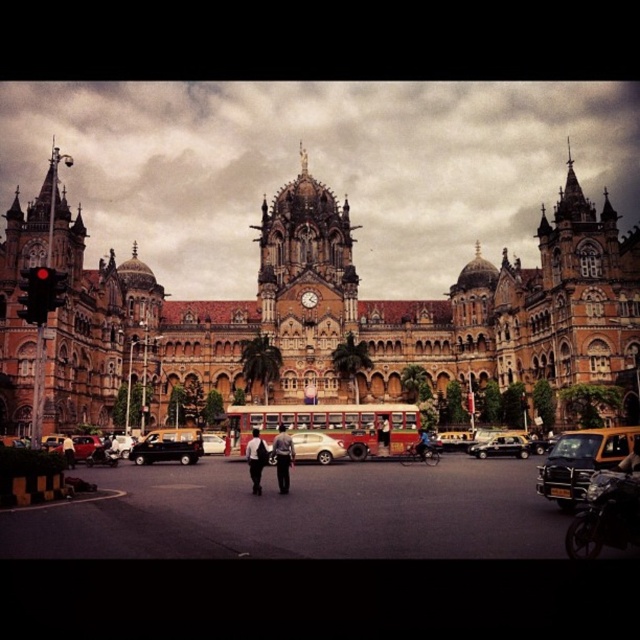
Is gold metallic sedan at center smaller than dark blue jeans at center?

No.

Between gold metallic sedan at center and dark blue jeans at center, which one has less height?

dark blue jeans at center

The height and width of the screenshot is (640, 640). In order to click on gold metallic sedan at center in this screenshot , I will do `click(316, 445)`.

Who is positioned more to the left, red matte bus at center or black glossy car at center?

From the viewer's perspective, red matte bus at center appears more on the left side.

Is red matte bus at center to the right of black glossy car at center from the viewer's perspective?

No, red matte bus at center is not to the right of black glossy car at center.

Who is more forward, (326, 417) or (474, 454)?

Point (326, 417) is in front.

Where is `red matte bus at center`? Image resolution: width=640 pixels, height=640 pixels. red matte bus at center is located at coordinates (328, 426).

Which is more to the left, dark gray pants at center or black leather jacket at center?

dark gray pants at center

Based on the photo, who is taller, dark gray pants at center or black leather jacket at center?

dark gray pants at center is taller.

Who is more forward, (289, 483) or (385, 442)?

Positioned in front is point (289, 483).

At what (x,y) coordinates should I click in order to perform the action: click on dark gray pants at center. Please return your answer as a coordinate pair (x, y). Looking at the image, I should click on (282, 458).